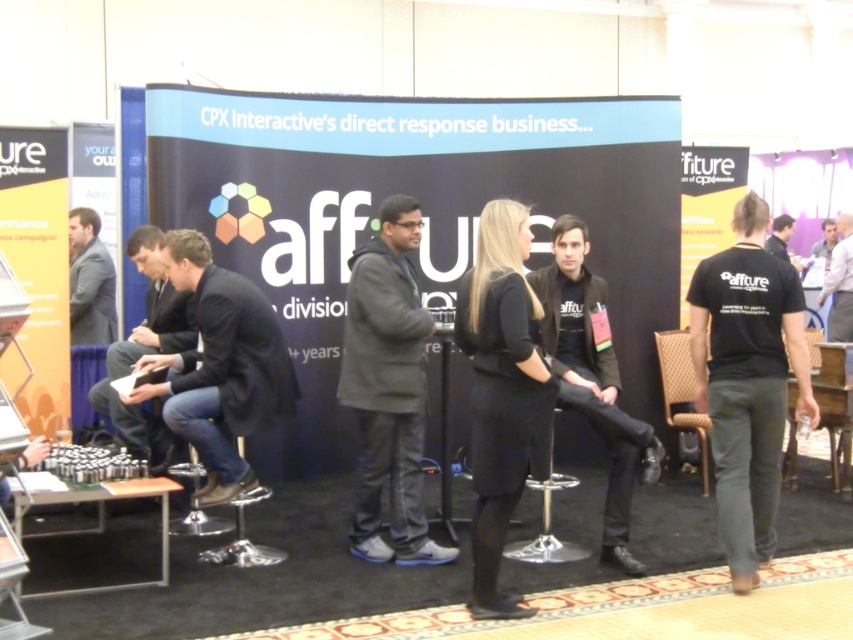
You are a GUI agent. You are given a task and a screenshot of the screen. Output one action in this format:
    pyautogui.click(x=<x>, y=<y>)
    Task: Click on the black matte jacket at center
    Image resolution: width=853 pixels, height=640 pixels.
    Given the screenshot: What is the action you would take?
    pyautogui.click(x=593, y=380)

Is black matte jacket at center above light blue shirt at upper right?

Actually, black matte jacket at center is below light blue shirt at upper right.

You are a GUI agent. You are given a task and a screenshot of the screen. Output one action in this format:
    pyautogui.click(x=<x>, y=<y>)
    Task: Click on the black matte jacket at center
    This screenshot has width=853, height=640.
    Given the screenshot: What is the action you would take?
    pyautogui.click(x=593, y=380)

You are a GUI agent. You are given a task and a screenshot of the screen. Output one action in this format:
    pyautogui.click(x=<x>, y=<y>)
    Task: Click on the black matte jacket at center
    The image size is (853, 640).
    Given the screenshot: What is the action you would take?
    pyautogui.click(x=593, y=380)

Is black fabric shirt at right positioned behind light blue shirt at upper right?

That is False.

Which is above, black fabric shirt at right or light blue shirt at upper right?

black fabric shirt at right

Is point (788, 259) farther from viewer compared to point (819, 253)?

That is False.

In order to click on black fabric shirt at right in this screenshot , I will do `click(779, 236)`.

Can you confirm if black cotton t-shirt at right is thinner than white shirt at upper right?

No.

Is point (737, 541) in front of point (827, 282)?

Yes, point (737, 541) is closer to viewer.

The image size is (853, 640). What do you see at coordinates (747, 381) in the screenshot?
I see `black cotton t-shirt at right` at bounding box center [747, 381].

Where is `black cotton t-shirt at right`? The height and width of the screenshot is (640, 853). black cotton t-shirt at right is located at coordinates (747, 381).